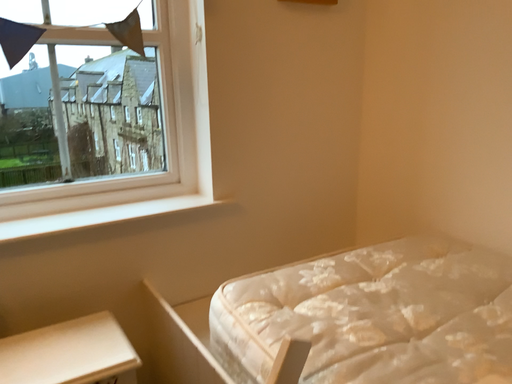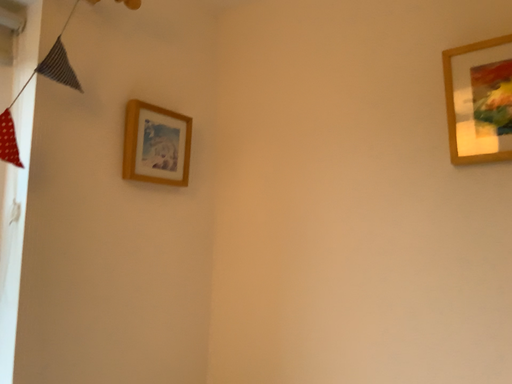
Question: How did the camera likely rotate when shooting the video?

Choices:
 (A) rotated upward
 (B) rotated downward

Answer: (A)